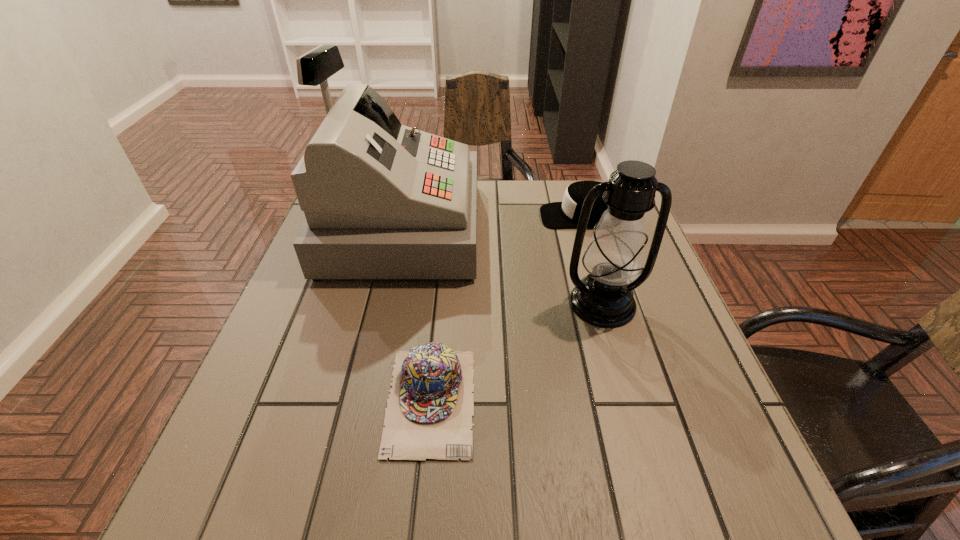
Where is `vacant area that satisfies the following two spatial constraints: 1. on the front-facing side of the right cap; 2. on the front, side, and top of the shorter cap`? vacant area that satisfies the following two spatial constraints: 1. on the front-facing side of the right cap; 2. on the front, side, and top of the shorter cap is located at coordinates (636, 401).

This screenshot has width=960, height=540. Identify the location of vacant point that satisfies the following two spatial constraints: 1. on the front-facing side of the taller cap; 2. on the front side of the third shortest object. (608, 303).